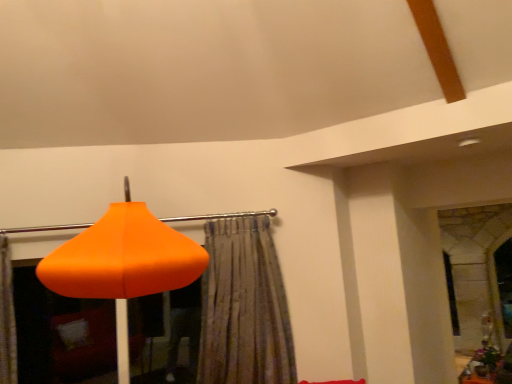
Question: Does textured beige curtain at center have a larger size compared to orange matte lampshade at lower left?

Choices:
 (A) yes
 (B) no

Answer: (B)

Question: Is textured beige curtain at center not inside orange matte lampshade at lower left?

Choices:
 (A) no
 (B) yes

Answer: (A)

Question: From a real-world perspective, is textured beige curtain at center physically above orange matte lampshade at lower left?

Choices:
 (A) yes
 (B) no

Answer: (B)

Question: Does textured beige curtain at center appear on the left side of orange matte lampshade at lower left?

Choices:
 (A) no
 (B) yes

Answer: (A)

Question: Is textured beige curtain at center closer to camera compared to orange matte lampshade at lower left?

Choices:
 (A) no
 (B) yes

Answer: (A)

Question: Would you say textured beige curtain at center contains orange matte lampshade at lower left?

Choices:
 (A) yes
 (B) no

Answer: (B)

Question: From the image's perspective, is wooden textured table at lower right on orange matte lampshade at lower left?

Choices:
 (A) yes
 (B) no

Answer: (B)

Question: Would you say wooden textured table at lower right contains orange matte lampshade at lower left?

Choices:
 (A) yes
 (B) no

Answer: (B)

Question: Can you confirm if wooden textured table at lower right is smaller than orange matte lampshade at lower left?

Choices:
 (A) no
 (B) yes

Answer: (B)

Question: Does wooden textured table at lower right have a lesser height compared to orange matte lampshade at lower left?

Choices:
 (A) yes
 (B) no

Answer: (A)

Question: Is wooden textured table at lower right not inside orange matte lampshade at lower left?

Choices:
 (A) yes
 (B) no

Answer: (A)

Question: Is wooden textured table at lower right to the right of orange matte lampshade at lower left from the viewer's perspective?

Choices:
 (A) no
 (B) yes

Answer: (B)

Question: Can you confirm if orange matte lampshade at lower left is positioned to the left of textured beige curtain at center?

Choices:
 (A) yes
 (B) no

Answer: (A)